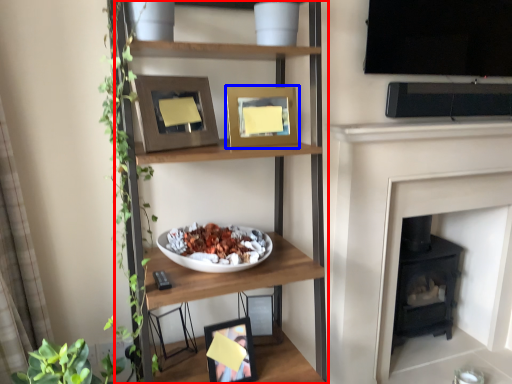
Question: Among these objects, which one is farthest to the camera, shelf (highlighted by a red box) or picture frame (highlighted by a blue box)?

Choices:
 (A) shelf
 (B) picture frame

Answer: (B)